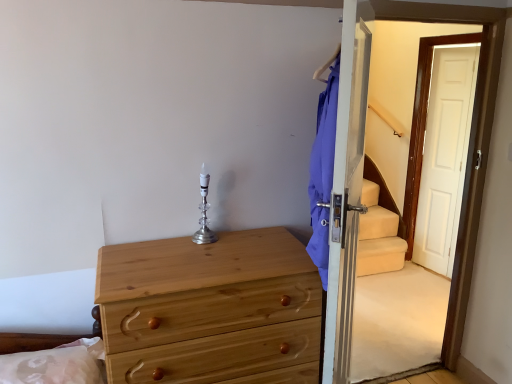
Locate an element on the screen. Image resolution: width=512 pixels, height=384 pixels. vacant space that is to the left of silver/crystal candle holder at center is located at coordinates (159, 242).